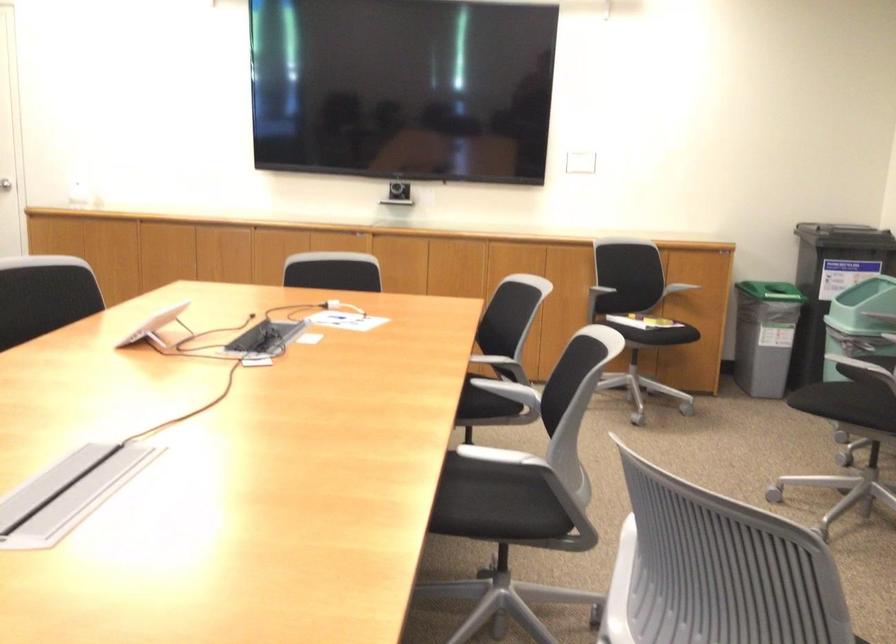
Describe the element at coordinates (858, 323) in the screenshot. The height and width of the screenshot is (644, 896). I see `the green trash bin lid` at that location.